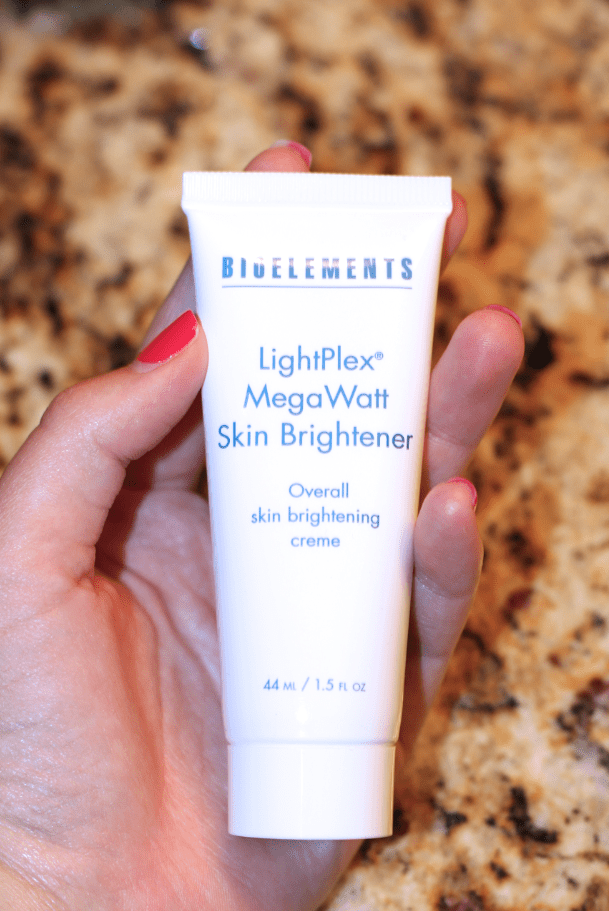
In order to click on lotion in this screenshot , I will do `click(290, 447)`.